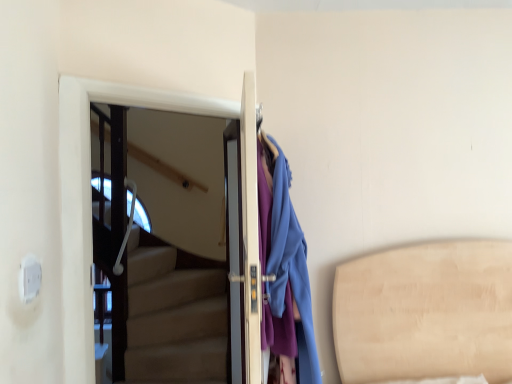
Question: Is matte blue coat at right bigger than white glossy door at upper left, the 2th door from the right?

Choices:
 (A) no
 (B) yes

Answer: (B)

Question: Is matte blue coat at right taller than white glossy door at upper left, the 2th door from the right?

Choices:
 (A) no
 (B) yes

Answer: (A)

Question: Is matte blue coat at right directly adjacent to white glossy door at upper left, placed as the first door when sorted from left to right?

Choices:
 (A) yes
 (B) no

Answer: (B)

Question: From a real-world perspective, is matte blue coat at right positioned over white glossy door at upper left, placed as the first door when sorted from left to right, based on gravity?

Choices:
 (A) no
 (B) yes

Answer: (A)

Question: Is matte blue coat at right thinner than white glossy door at upper left, placed as the first door when sorted from left to right?

Choices:
 (A) no
 (B) yes

Answer: (A)

Question: Looking at their shapes, would you say white glossy door at upper left, placed as the first door when sorted from left to right, is wider or thinner than matte white door at center, acting as the 1th door starting from the right?

Choices:
 (A) thin
 (B) wide

Answer: (A)

Question: Is white glossy door at upper left, the 2th door from the right, taller or shorter than matte white door at center, which ranks as the 2th door in left-to-right order?

Choices:
 (A) short
 (B) tall

Answer: (B)

Question: From the image's perspective, relative to matte white door at center, which ranks as the 2th door in left-to-right order, is white glossy door at upper left, placed as the first door when sorted from left to right, above or below?

Choices:
 (A) below
 (B) above

Answer: (B)

Question: Relative to matte white door at center, which ranks as the 2th door in left-to-right order, is white glossy door at upper left, the 2th door from the right, in front or behind?

Choices:
 (A) front
 (B) behind

Answer: (B)

Question: Relative to matte white door at center, which ranks as the 2th door in left-to-right order, is matte blue coat at right in front or behind?

Choices:
 (A) front
 (B) behind

Answer: (A)

Question: Is matte blue coat at right inside or outside of matte white door at center, acting as the 1th door starting from the right?

Choices:
 (A) inside
 (B) outside

Answer: (B)

Question: Is matte blue coat at right bigger or smaller than matte white door at center, which ranks as the 2th door in left-to-right order?

Choices:
 (A) big
 (B) small

Answer: (A)

Question: Considering the positions of matte blue coat at right and matte white door at center, acting as the 1th door starting from the right, in the image, is matte blue coat at right taller or shorter than matte white door at center, acting as the 1th door starting from the right,?

Choices:
 (A) tall
 (B) short

Answer: (A)

Question: Considering the positions of point (62, 213) and point (296, 233), is point (62, 213) closer or farther from the camera than point (296, 233)?

Choices:
 (A) closer
 (B) farther

Answer: (B)

Question: From a real-world perspective, relative to matte blue coat at right, is white glossy door at upper left, the 2th door from the right, vertically above or below?

Choices:
 (A) above
 (B) below

Answer: (A)